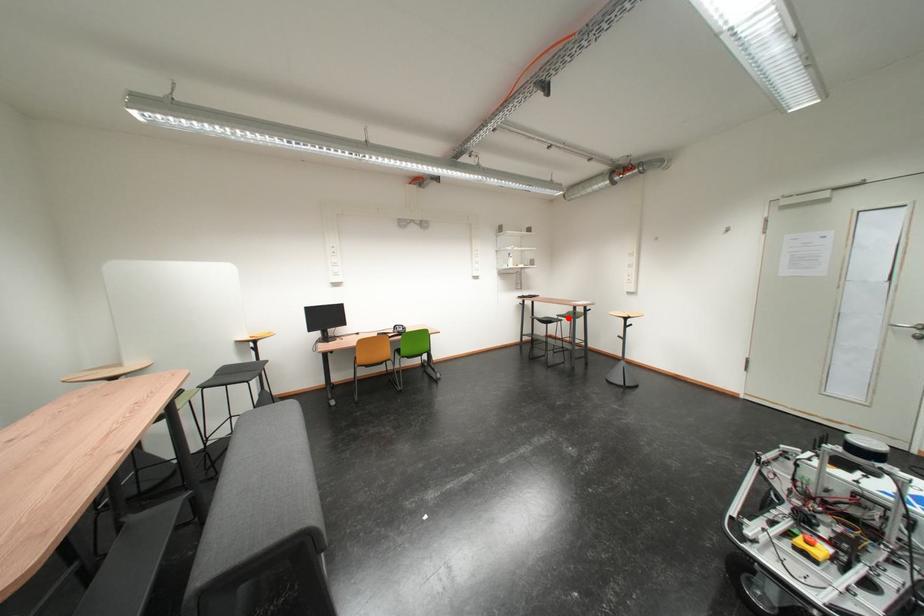
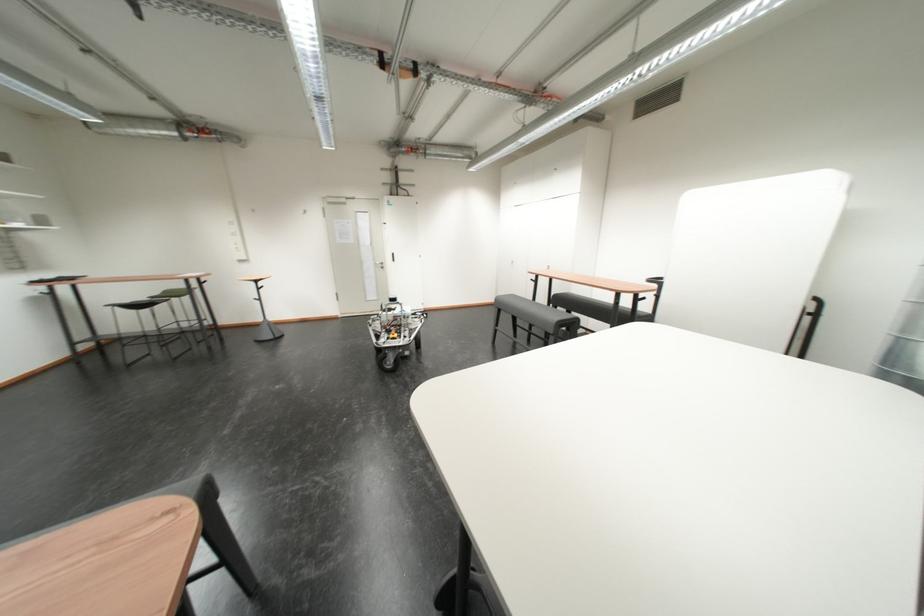
In the second image, find the point that corresponds to the highlighted location in the first image.

(160, 300)